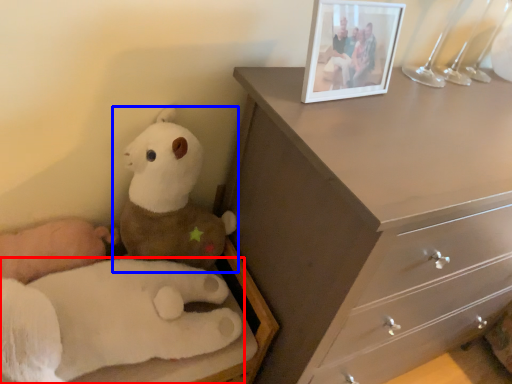
Question: Which object appears closest to the camera in this image, toy (highlighted by a red box) or toy (highlighted by a blue box)?

Choices:
 (A) toy
 (B) toy

Answer: (A)